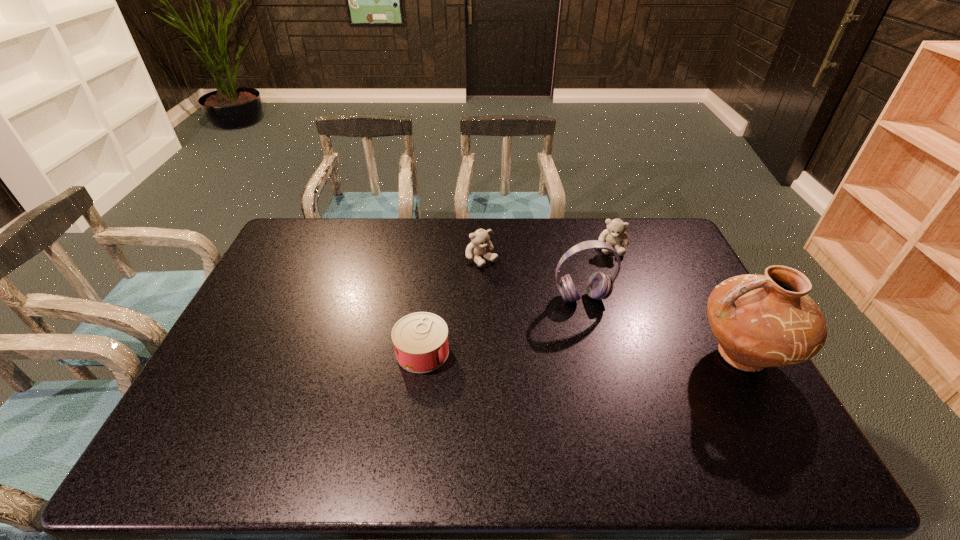
At what (x,y) coordinates should I click in order to perform the action: click on the shortest object. Please return your answer as a coordinate pair (x, y). Looking at the image, I should click on tap(420, 340).

You are a GUI agent. You are given a task and a screenshot of the screen. Output one action in this format:
    pyautogui.click(x=<x>, y=<y>)
    Task: Click on the leftmost object
    The image size is (960, 540).
    Given the screenshot: What is the action you would take?
    pyautogui.click(x=420, y=340)

Locate an element on the screen. This screenshot has width=960, height=540. the tallest object is located at coordinates (760, 321).

The width and height of the screenshot is (960, 540). I want to click on pottery, so (760, 321).

Find the location of a particular element. the second object from left to right is located at coordinates (480, 240).

In order to click on the second object from right to left in this screenshot , I will do `click(615, 235)`.

I want to click on the third object from left to right, so click(599, 286).

Where is `the second tallest object`? The height and width of the screenshot is (540, 960). the second tallest object is located at coordinates (599, 286).

Locate an element on the screen. free space located on the right of the can is located at coordinates (570, 352).

This screenshot has width=960, height=540. In order to click on free space located 0.190m on the side of the rightmost object with the handle in this screenshot , I will do `click(625, 355)`.